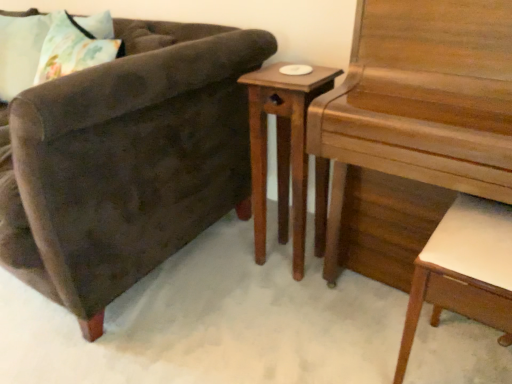
Question: Is white leather desk at lower right bigger than fluffy fabric pillow at upper left?

Choices:
 (A) yes
 (B) no

Answer: (A)

Question: Is white leather desk at lower right not inside fluffy fabric pillow at upper left?

Choices:
 (A) no
 (B) yes

Answer: (B)

Question: From the image's perspective, is white leather desk at lower right located above fluffy fabric pillow at upper left?

Choices:
 (A) yes
 (B) no

Answer: (B)

Question: From the image's perspective, is white leather desk at lower right beneath fluffy fabric pillow at upper left?

Choices:
 (A) yes
 (B) no

Answer: (A)

Question: Considering the relative sizes of white leather desk at lower right and fluffy fabric pillow at upper left in the image provided, is white leather desk at lower right thinner than fluffy fabric pillow at upper left?

Choices:
 (A) no
 (B) yes

Answer: (A)

Question: Is white leather desk at lower right at the right side of fluffy fabric pillow at upper left?

Choices:
 (A) no
 (B) yes

Answer: (B)

Question: Is fluffy fabric pillow at upper left outside white leather desk at lower right?

Choices:
 (A) yes
 (B) no

Answer: (A)

Question: Is white leather desk at lower right inside fluffy fabric pillow at upper left?

Choices:
 (A) yes
 (B) no

Answer: (B)

Question: Considering the relative sizes of fluffy fabric pillow at upper left and white leather desk at lower right in the image provided, is fluffy fabric pillow at upper left wider than white leather desk at lower right?

Choices:
 (A) yes
 (B) no

Answer: (B)

Question: Is fluffy fabric pillow at upper left thinner than white leather desk at lower right?

Choices:
 (A) yes
 (B) no

Answer: (A)

Question: Does fluffy fabric pillow at upper left have a smaller size compared to white leather desk at lower right?

Choices:
 (A) no
 (B) yes

Answer: (B)

Question: Is fluffy fabric pillow at upper left next to white leather desk at lower right and touching it?

Choices:
 (A) yes
 (B) no

Answer: (B)

Question: Considering the relative positions of wooden nightstand at center and wooden piano at right in the image provided, is wooden nightstand at center in front of wooden piano at right?

Choices:
 (A) yes
 (B) no

Answer: (B)